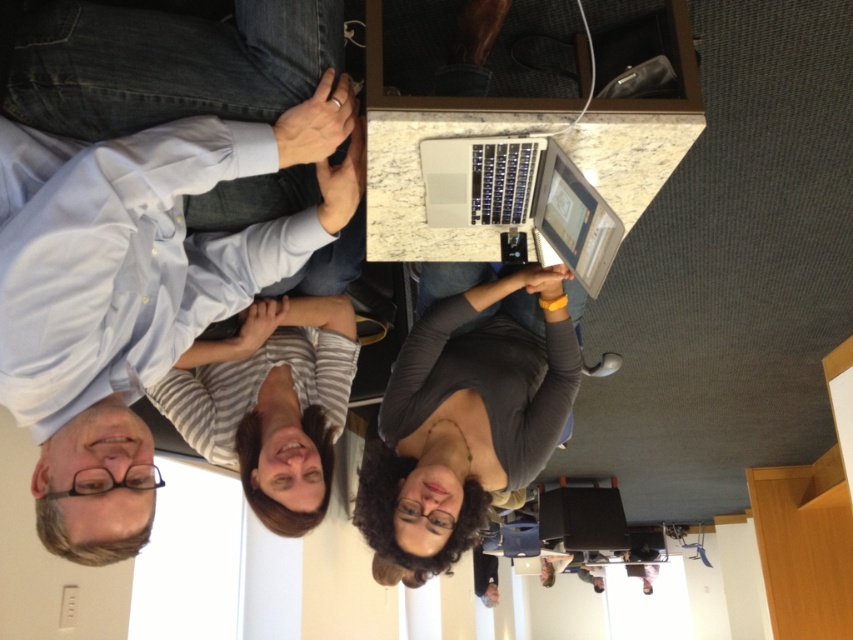
Can you confirm if striped fabric shirt at center is positioned to the left of sleek silver laptop at center?

Correct, you'll find striped fabric shirt at center to the left of sleek silver laptop at center.

Between striped fabric shirt at center and sleek silver laptop at center, which one has less height?

With less height is sleek silver laptop at center.

Between point (235, 387) and point (492, 136), which one is positioned in front?

Point (492, 136)

Where is `striped fabric shirt at center`? striped fabric shirt at center is located at coordinates (270, 403).

Which is above, light blue shirt at upper left or gray matte shirt at center?

light blue shirt at upper left

This screenshot has height=640, width=853. In order to click on light blue shirt at upper left in this screenshot , I will do click(x=136, y=291).

Is light blue shirt at upper left above striped fabric shirt at center?

Indeed, light blue shirt at upper left is positioned over striped fabric shirt at center.

Is light blue shirt at upper left further to camera compared to striped fabric shirt at center?

No.

Does point (70, 282) come farther from viewer compared to point (229, 400)?

No, (70, 282) is closer to viewer.

You are a GUI agent. You are given a task and a screenshot of the screen. Output one action in this format:
    pyautogui.click(x=<x>, y=<y>)
    Task: Click on the light blue shirt at upper left
    
    Given the screenshot: What is the action you would take?
    pyautogui.click(x=136, y=291)